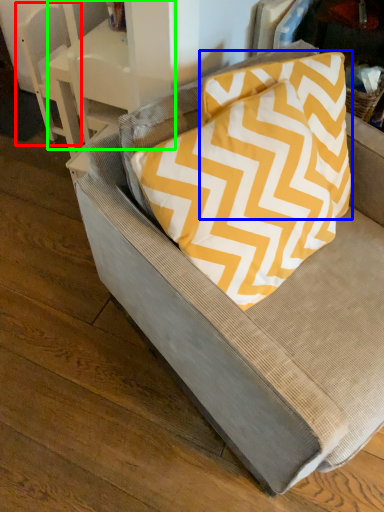
Question: Estimate the real-world distances between objects in this image. Which object is closer to armchair (highlighted by a red box), pillow (highlighted by a blue box) or table (highlighted by a green box)?

Choices:
 (A) pillow
 (B) table

Answer: (B)